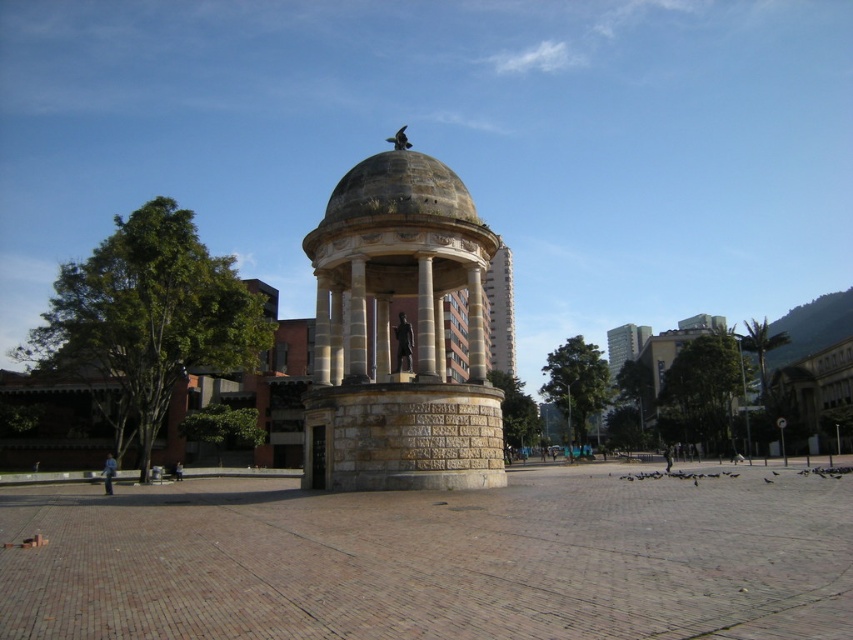
Question: Is stone gazebo at center further to camera compared to smooth concrete tower at center?

Choices:
 (A) no
 (B) yes

Answer: (A)

Question: Does stone gazebo at center appear on the left side of smooth concrete tower at center?

Choices:
 (A) yes
 (B) no

Answer: (A)

Question: In this image, where is stone gazebo at center located relative to smooth concrete tower at center?

Choices:
 (A) below
 (B) above

Answer: (B)

Question: Which object appears closest to the camera in this image?

Choices:
 (A) smooth concrete tower at center
 (B) stone gazebo at center

Answer: (B)